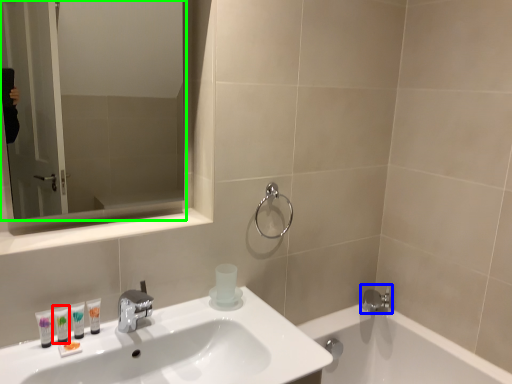
Question: Based on their relative distances, which object is nearer to mouthwash (highlighted by a red box)? Choose from tap (highlighted by a blue box) and mirror (highlighted by a green box).

Choices:
 (A) tap
 (B) mirror

Answer: (A)